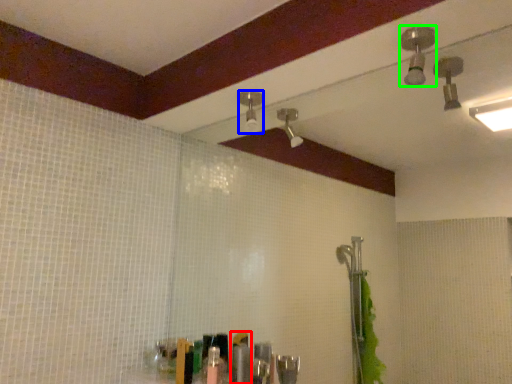
Question: Considering the real-world distances, which object is closest to toiletry (highlighted by a red box)? shower (highlighted by a blue box) or shower (highlighted by a green box).

Choices:
 (A) shower
 (B) shower

Answer: (A)